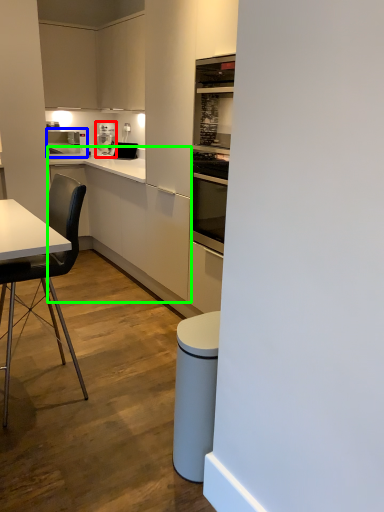
Question: Which object is positioned farthest from kitchen appliance (highlighted by a red box)? Select from kitchen appliance (highlighted by a blue box) and counter (highlighted by a green box).

Choices:
 (A) kitchen appliance
 (B) counter

Answer: (B)